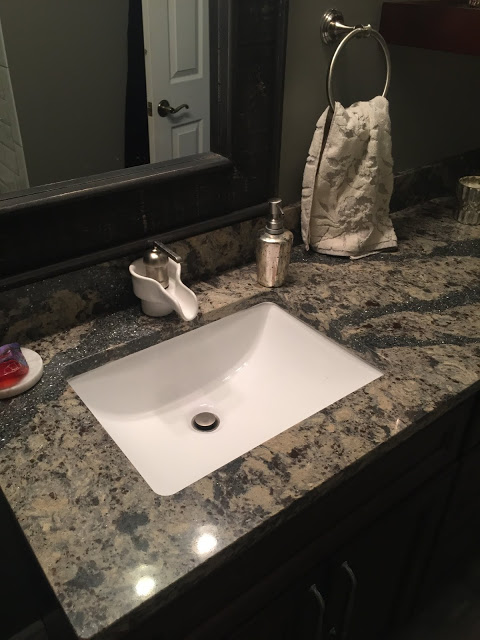
Locate an element on the screen. This screenshot has width=480, height=640. door handles is located at coordinates (322, 612), (351, 596).